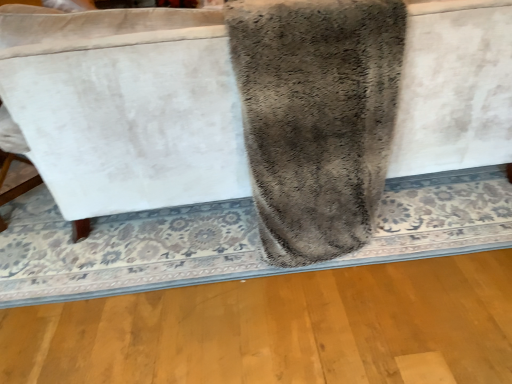
Where is `fuzzy gray towel at center`? Image resolution: width=512 pixels, height=384 pixels. fuzzy gray towel at center is located at coordinates (316, 117).

What do you see at coordinates (316, 117) in the screenshot?
I see `fuzzy gray towel at center` at bounding box center [316, 117].

You are a GUI agent. You are given a task and a screenshot of the screen. Output one action in this format:
    pyautogui.click(x=<x>, y=<y>)
    Task: Click on the fuzzy gray towel at center
    Image resolution: width=512 pixels, height=384 pixels.
    Given the screenshot: What is the action you would take?
    pyautogui.click(x=316, y=117)